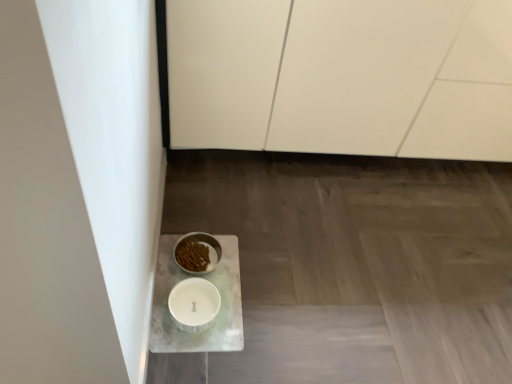
Question: Is white matte cabinet at upper center surrounded by white glossy bowl at lower left, arranged as the first tableware when viewed from the top?

Choices:
 (A) yes
 (B) no

Answer: (B)

Question: Is white glossy bowl at lower left, arranged as the first tableware when viewed from the top, to the right of white matte cabinet at upper center from the viewer's perspective?

Choices:
 (A) yes
 (B) no

Answer: (B)

Question: Are white glossy bowl at lower left, acting as the 2th tableware starting from the bottom, and white matte cabinet at upper center far apart?

Choices:
 (A) no
 (B) yes

Answer: (A)

Question: Considering the relative sizes of white glossy bowl at lower left, acting as the 2th tableware starting from the bottom, and white matte cabinet at upper center in the image provided, is white glossy bowl at lower left, acting as the 2th tableware starting from the bottom, smaller than white matte cabinet at upper center?

Choices:
 (A) no
 (B) yes

Answer: (B)

Question: Is the depth of white glossy bowl at lower left, acting as the 2th tableware starting from the bottom, less than that of white matte cabinet at upper center?

Choices:
 (A) yes
 (B) no

Answer: (B)

Question: Is white glossy bowl at lower left, arranged as the first tableware when viewed from the top, to the left of white matte cabinet at upper center from the viewer's perspective?

Choices:
 (A) no
 (B) yes

Answer: (B)

Question: From a real-world perspective, is white matte cabinet at upper center located higher than white glossy bowl at lower left, acting as the 2th tableware starting from the bottom?

Choices:
 (A) no
 (B) yes

Answer: (B)

Question: From the image's perspective, is white matte cabinet at upper center located above white glossy bowl at lower left, arranged as the first tableware when viewed from the top?

Choices:
 (A) no
 (B) yes

Answer: (B)

Question: Is the position of white matte cabinet at upper center less distant than that of white glossy bowl at lower left, acting as the 2th tableware starting from the bottom?

Choices:
 (A) yes
 (B) no

Answer: (A)

Question: Is white matte cabinet at upper center bigger than white glossy bowl at lower left, acting as the 2th tableware starting from the bottom?

Choices:
 (A) no
 (B) yes

Answer: (B)

Question: From the image's perspective, is white matte cabinet at upper center beneath white glossy bowl at lower left, acting as the 2th tableware starting from the bottom?

Choices:
 (A) no
 (B) yes

Answer: (A)

Question: Is white matte cabinet at upper center far away from white glossy bowl at lower left, arranged as the first tableware when viewed from the top?

Choices:
 (A) yes
 (B) no

Answer: (B)

Question: Is white marble tray at lower left completely or partially outside of white matte cabinet at upper center?

Choices:
 (A) no
 (B) yes

Answer: (B)